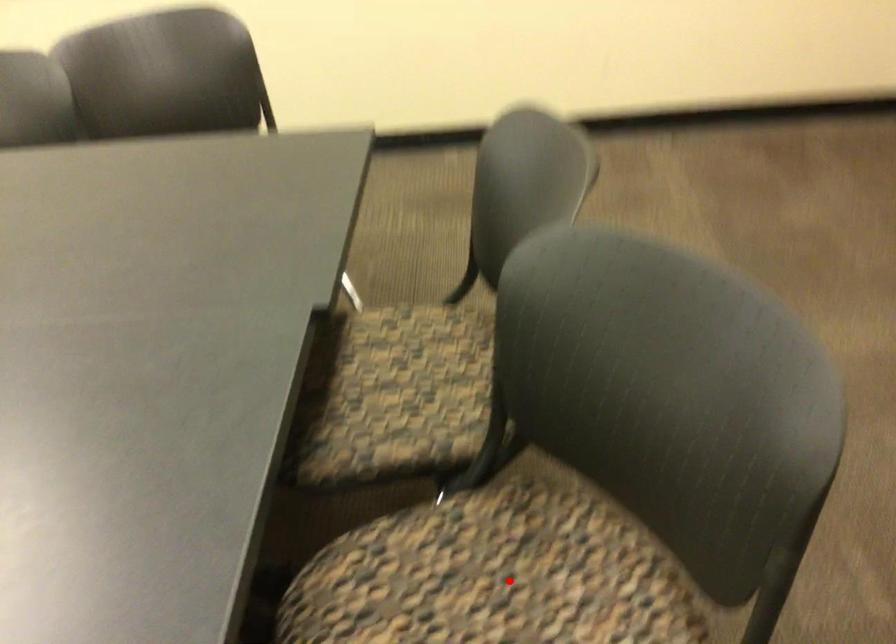
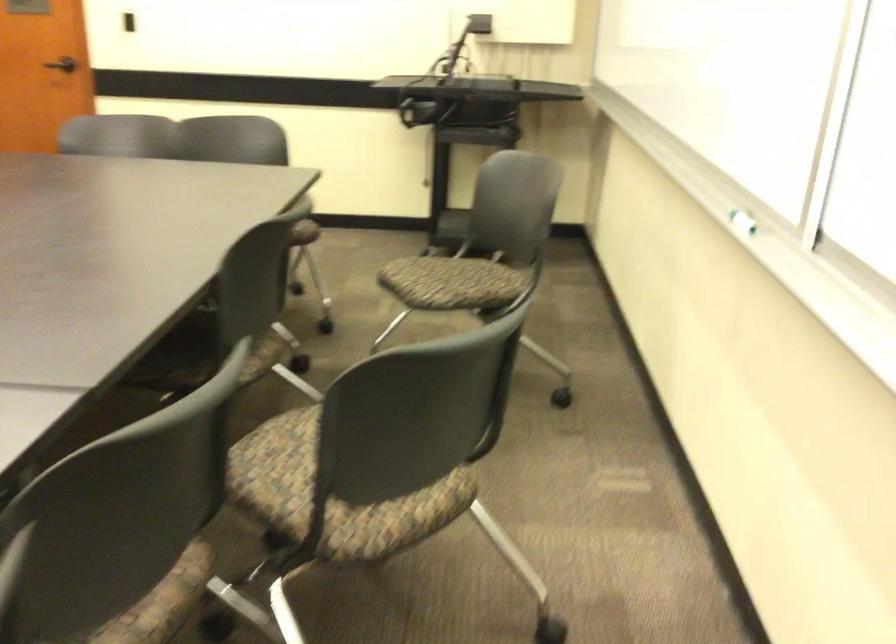
Question: I am providing you with two images of the same scene from different viewpoints. A red point is marked on the first image. Is the red point's position out of view in image 2?

Choices:
 (A) Yes
 (B) No

Answer: (A)